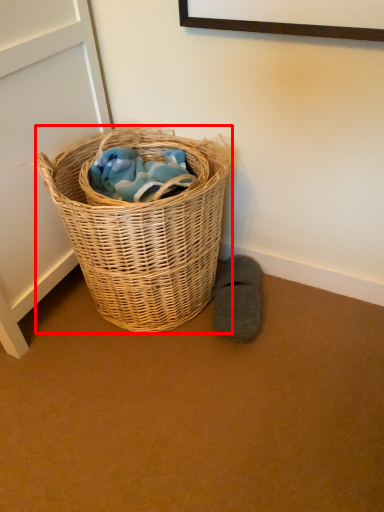
Question: From the image's perspective, what is the correct spatial positioning of picnic basket (annotated by the red box) in reference to footwear?

Choices:
 (A) below
 (B) above

Answer: (B)